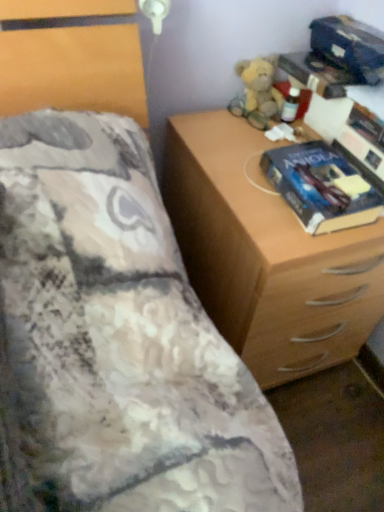
Identify the location of blank space above wooden chest of drawers at right (from a real-world perspective). This screenshot has height=512, width=384. (261, 157).